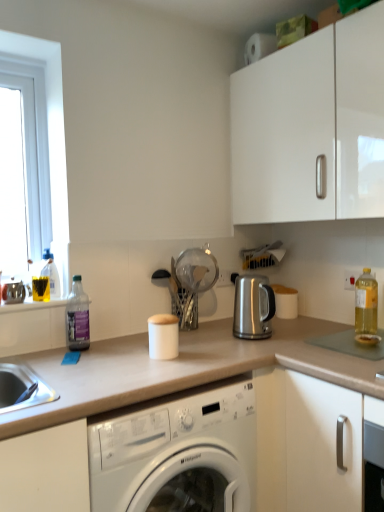
The height and width of the screenshot is (512, 384). Find the location of `vacant area situated below satin silver kettle at center, placed as the 1th appliance when sorted from right to left (from a real-world perspective)`. vacant area situated below satin silver kettle at center, placed as the 1th appliance when sorted from right to left (from a real-world perspective) is located at coordinates (269, 335).